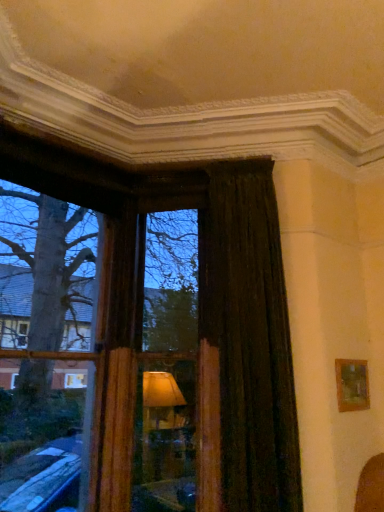
Question: Is dark velvet curtain at right taller than wooden frame at center?

Choices:
 (A) no
 (B) yes

Answer: (A)

Question: Can you confirm if dark velvet curtain at right is shorter than wooden frame at center?

Choices:
 (A) yes
 (B) no

Answer: (A)

Question: Is wooden frame at center located within dark velvet curtain at right?

Choices:
 (A) no
 (B) yes

Answer: (A)

Question: From a real-world perspective, is dark velvet curtain at right under wooden frame at center?

Choices:
 (A) no
 (B) yes

Answer: (B)

Question: Is dark velvet curtain at right looking in the opposite direction of wooden frame at center?

Choices:
 (A) yes
 (B) no

Answer: (B)

Question: Is point (180, 432) closer or farther from the camera than point (134, 346)?

Choices:
 (A) closer
 (B) farther

Answer: (B)

Question: Is wooden frame at center to the left or to the right of wooden frame at left in the image?

Choices:
 (A) right
 (B) left

Answer: (A)

Question: Is wooden frame at center taller or shorter than wooden frame at left?

Choices:
 (A) tall
 (B) short

Answer: (B)

Question: From the image's perspective, is wooden frame at center positioned above or below wooden frame at left?

Choices:
 (A) below
 (B) above

Answer: (A)

Question: From the image's perspective, is wooden frame at center located above or below dark velvet curtain at right?

Choices:
 (A) above
 (B) below

Answer: (B)

Question: Is wooden frame at center taller or shorter than dark velvet curtain at right?

Choices:
 (A) tall
 (B) short

Answer: (A)

Question: Would you say wooden frame at center is to the left or to the right of dark velvet curtain at right in the picture?

Choices:
 (A) right
 (B) left

Answer: (B)

Question: Does point (144, 441) appear closer or farther from the camera than point (253, 287)?

Choices:
 (A) farther
 (B) closer

Answer: (A)

Question: From the image's perspective, relative to wooden frame at center, is wooden frame at left above or below?

Choices:
 (A) below
 (B) above

Answer: (B)

Question: Relative to wooden frame at center, is wooden frame at left in front or behind?

Choices:
 (A) front
 (B) behind

Answer: (A)